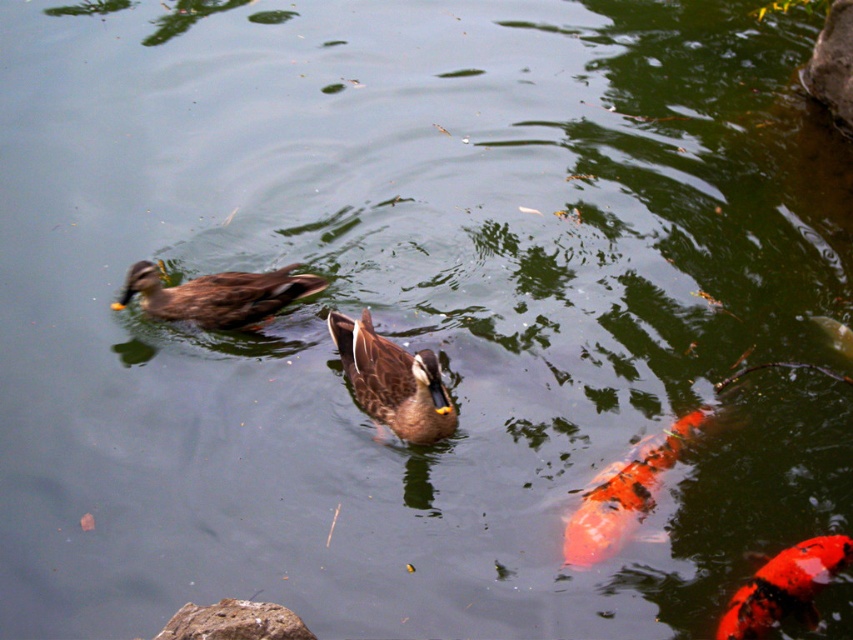
Is brown matte duck at center wider than brown matte duck at upper left?

In fact, brown matte duck at center might be narrower than brown matte duck at upper left.

In the scene shown: Can you confirm if brown matte duck at center is thinner than brown matte duck at upper left?

Yes, brown matte duck at center is thinner than brown matte duck at upper left.

Between point (428, 392) and point (189, 298), which one is positioned behind?

Point (189, 298)

Where is `brown matte duck at center`? brown matte duck at center is located at coordinates (x=392, y=380).

Does orange and white scaled fish at lower right have a lesser width compared to rough textured rock at lower left?

Incorrect, orange and white scaled fish at lower right's width is not less than rough textured rock at lower left's.

Is orange and white scaled fish at lower right further to camera compared to rough textured rock at lower left?

Yes.

Where is `orange and white scaled fish at lower right`? The image size is (853, 640). orange and white scaled fish at lower right is located at coordinates (625, 493).

Who is lower down, brown matte duck at center or rough textured rock at lower left?

rough textured rock at lower left is lower down.

Describe the element at coordinates (392, 380) in the screenshot. The height and width of the screenshot is (640, 853). I see `brown matte duck at center` at that location.

Which is behind, point (345, 320) or point (297, 620)?

Point (345, 320)

The width and height of the screenshot is (853, 640). I want to click on brown matte duck at center, so click(392, 380).